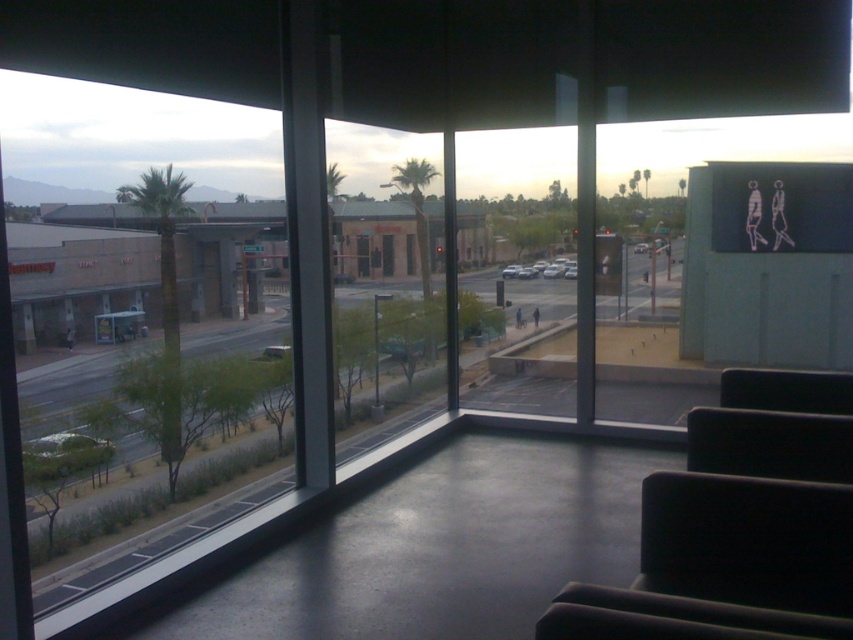
Question: Can you confirm if transparent glass window at left is positioned to the left of black fabric armchair at lower right?

Choices:
 (A) yes
 (B) no

Answer: (A)

Question: Which point is farther from the camera taking this photo?

Choices:
 (A) (788, 387)
 (B) (131, 172)

Answer: (B)

Question: Is transparent glass window at left smaller than black fabric armchair at lower right?

Choices:
 (A) yes
 (B) no

Answer: (B)

Question: Which point is farther to the camera?

Choices:
 (A) (45, 340)
 (B) (764, 509)

Answer: (A)

Question: Which point is farther to the camera?

Choices:
 (A) black fabric armchair at lower right
 (B) transparent glass window at left

Answer: (B)

Question: Is transparent glass window at left further to the viewer compared to black fabric armchair at lower right?

Choices:
 (A) no
 (B) yes

Answer: (B)